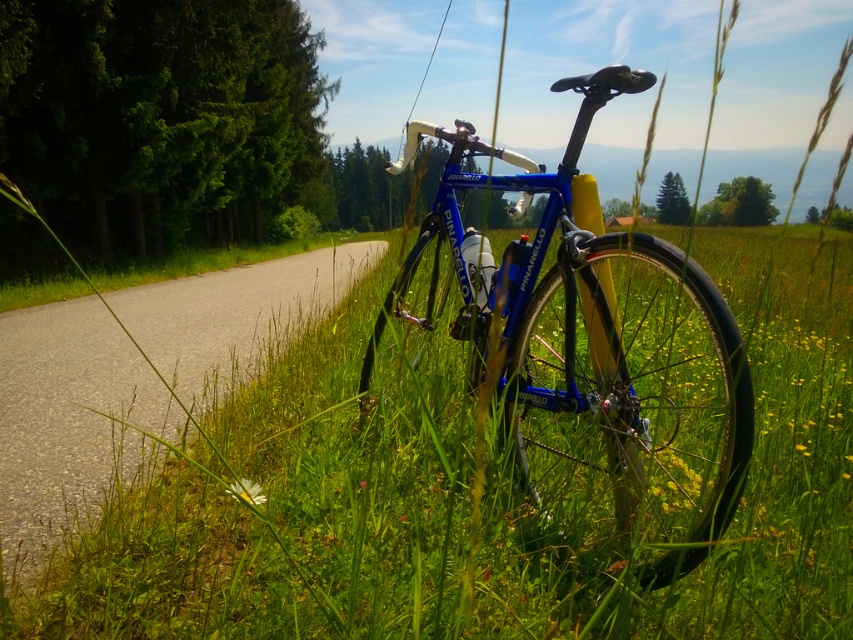
Question: Among these points, which one is nearest to the camera?

Choices:
 (A) (592, 388)
 (B) (113, 380)

Answer: (A)

Question: Can you confirm if blue metallic bicycle at center is thinner than asphalt road at center?

Choices:
 (A) no
 (B) yes

Answer: (B)

Question: Is blue metallic bicycle at center in front of asphalt road at center?

Choices:
 (A) yes
 (B) no

Answer: (A)

Question: Is blue metallic bicycle at center positioned before asphalt road at center?

Choices:
 (A) no
 (B) yes

Answer: (B)